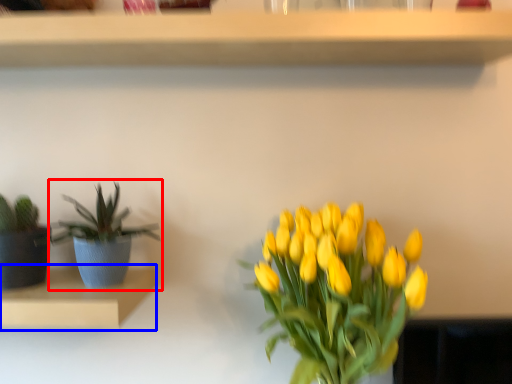
Question: Which of the following is the farthest to the observer, houseplant (highlighted by a red box) or shelf (highlighted by a blue box)?

Choices:
 (A) houseplant
 (B) shelf

Answer: (A)